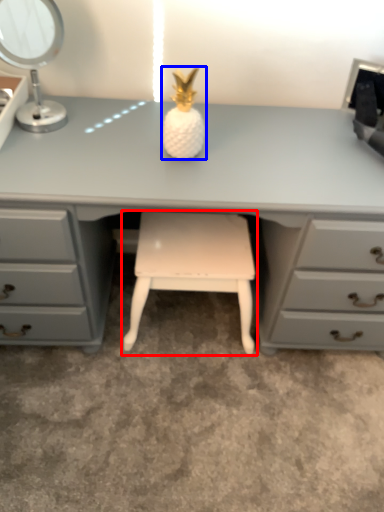
Question: Which object is closer to the camera taking this photo, stool (highlighted by a red box) or miniature (highlighted by a blue box)?

Choices:
 (A) stool
 (B) miniature

Answer: (B)